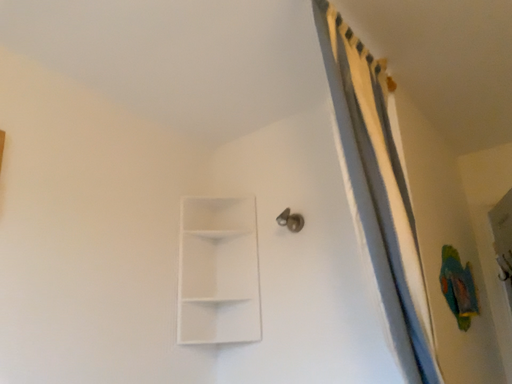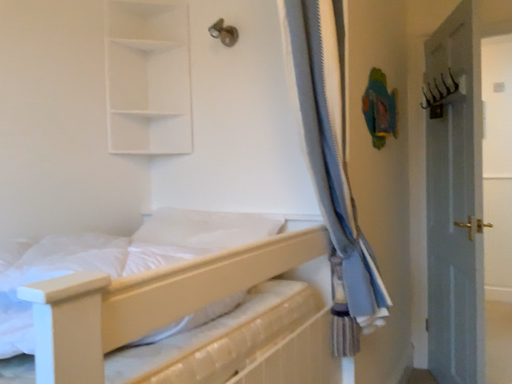
Question: How did the camera likely rotate when shooting the video?

Choices:
 (A) rotated left
 (B) rotated right

Answer: (B)